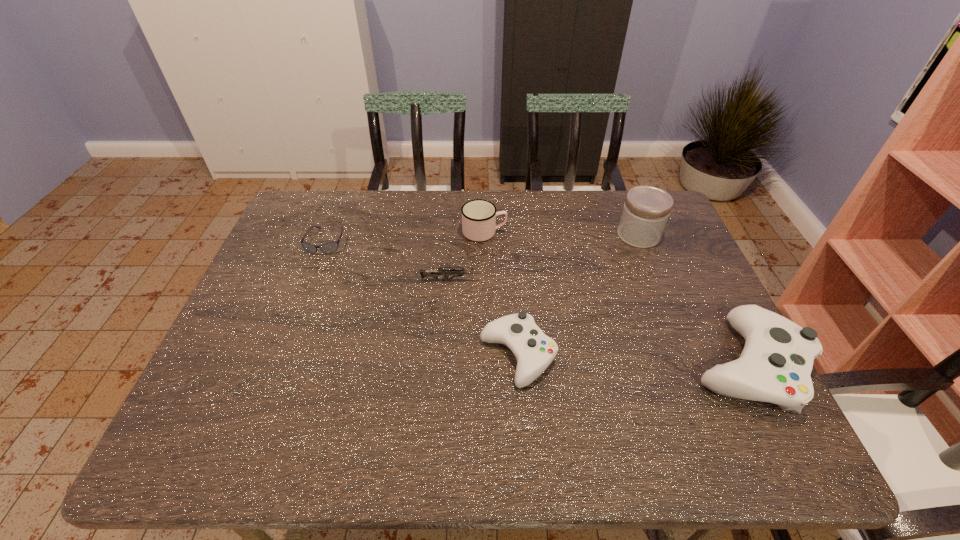
You are a GUI agent. You are given a task and a screenshot of the screen. Output one action in this format:
    pyautogui.click(x=<x>, y=<y>)
    Task: Click on the jar present at the right edge
    This screenshot has width=960, height=540.
    Given the screenshot: What is the action you would take?
    coord(646,210)

Locate an element on the screen. The image size is (960, 540). object situated at the far left corner is located at coordinates (327, 248).

What are the coordinates of `object that is at the far right corner` in the screenshot? It's located at (646, 210).

Where is `object that is at the near right corner`? object that is at the near right corner is located at coordinates (775, 365).

Image resolution: width=960 pixels, height=540 pixels. Identify the location of vacant point at the far edge. (417, 224).

You are a GUI agent. You are given a task and a screenshot of the screen. Output one action in this format:
    pyautogui.click(x=<x>, y=<y>)
    Task: Click on the free space at the near edge
    The height and width of the screenshot is (540, 960).
    Given the screenshot: What is the action you would take?
    pyautogui.click(x=549, y=387)

Identify the location of vacant space at the left edge. (228, 345).

Identify the location of free space at the right edge of the desktop. (658, 274).

In the image, there is a desktop. At what (x,y) coordinates should I click in order to perform the action: click on free space at the far left corner. Please return your answer as a coordinate pair (x, y). Looking at the image, I should click on (319, 208).

At what (x,y) coordinates should I click in order to perform the action: click on free region at the near left corner of the desktop. Please return your answer as a coordinate pair (x, y). Looking at the image, I should click on (253, 384).